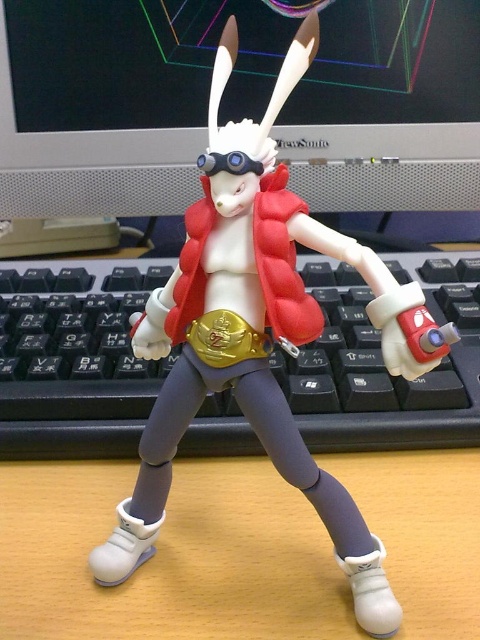
You are an action figure collector examining the scene. You need to place a new action figure between the matte black monitor at upper center and the black plastic keyboard at center. Which object should the figure be closer to if it needs to be placed closer to the one that is farther from you?

The matte black monitor at upper center is further to the viewer than the black plastic keyboard at center. Therefore, to place the new action figure closer to the object that is farther away, it should be positioned nearer to the matte black monitor at upper center.

You are an action figure collector examining the image. You want to know if the matte red jacket at center is positioned above or below the blue matte goggles at center. Can you tell me?

The matte red jacket at center is below the blue matte goggles at center.